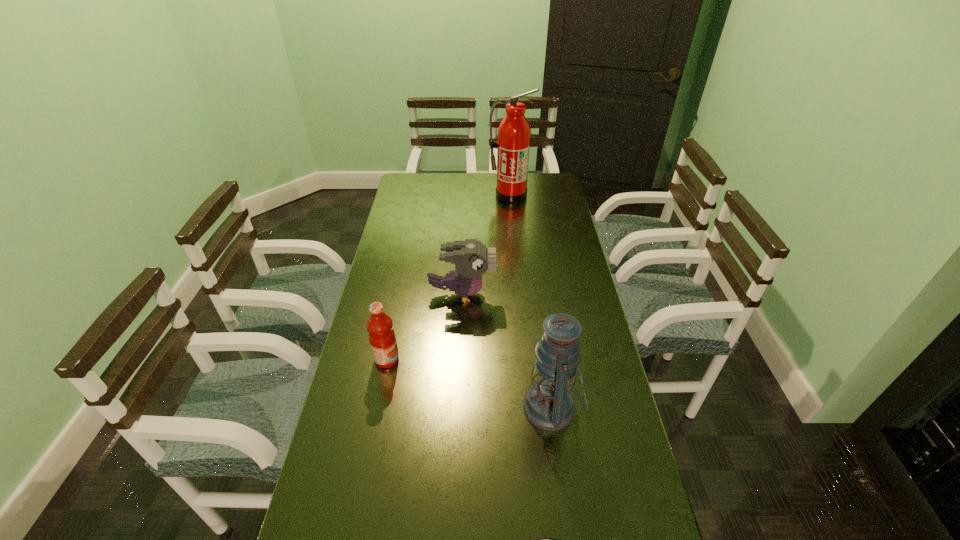
Identify the location of vacant position at the right edge of the desktop. The image size is (960, 540). (588, 333).

The width and height of the screenshot is (960, 540). In order to click on free point at the far left corner in this screenshot , I will do `click(428, 187)`.

I want to click on vacant area between the fourth shortest object and the fruit juice, so click(469, 383).

The width and height of the screenshot is (960, 540). I want to click on unoccupied position between the second nearest object and the leftmost object, so click(469, 383).

You are a GUI agent. You are given a task and a screenshot of the screen. Output one action in this format:
    pyautogui.click(x=<x>, y=<y>)
    Task: Click on the free space between the second farthest object and the second tallest object
    
    Given the screenshot: What is the action you would take?
    pyautogui.click(x=507, y=350)

In order to click on unoccupied area between the lantern and the fire extinguisher in this screenshot , I will do `click(531, 301)`.

At what (x,y) coordinates should I click in order to perform the action: click on object that is the second closest to the fruit juice. Please return your answer as a coordinate pair (x, y). Looking at the image, I should click on (548, 404).

Select which object appears as the third closest to the farthest object. Please provide its 2D coordinates. Your answer should be formatted as a tuple, i.e. [(x, y)], where the tuple contains the x and y coordinates of a point satisfying the conditions above.

[(548, 404)]

The image size is (960, 540). What are the coordinates of `free space that satisfies the following two spatial constraints: 1. on the label side of the tallest object; 2. at the beak of the bird` in the screenshot? It's located at (518, 294).